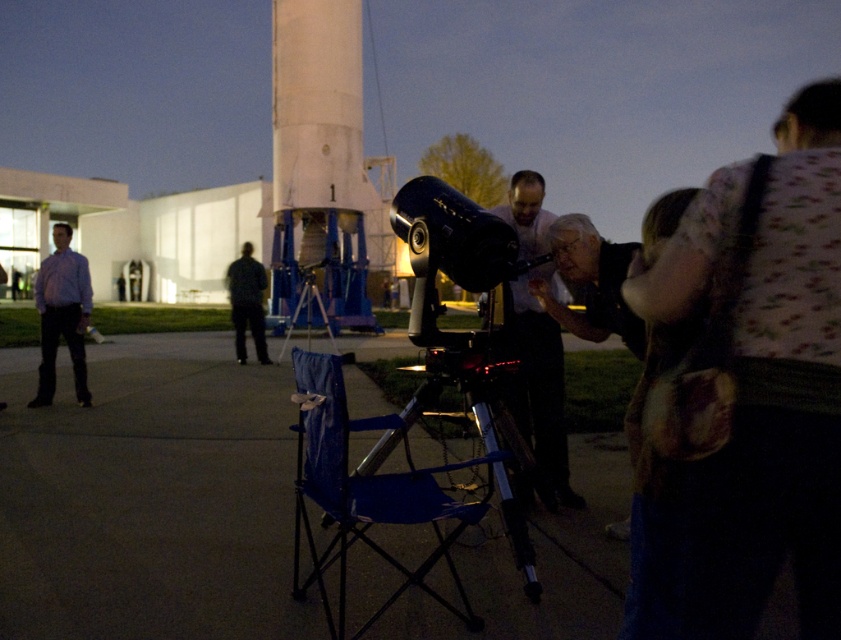
Question: Observing the image, what is the correct spatial positioning of white matte rocket at center in reference to blue fabric chair at lower center?

Choices:
 (A) above
 (B) below

Answer: (A)

Question: Can you confirm if light purple shirt at left is positioned above dark gray fabric pants at lower left?

Choices:
 (A) yes
 (B) no

Answer: (B)

Question: Which object is the farthest from the dark gray fabric pants at lower left?

Choices:
 (A) light purple shirt at left
 (B) white matte rocket at center

Answer: (B)

Question: Which point is farther from the camera taking this photo?

Choices:
 (A) (274, 264)
 (B) (242, 292)
 (C) (316, 449)
 (D) (541, 310)

Answer: (A)

Question: Which point is closer to the camera taking this photo?

Choices:
 (A) (541, 276)
 (B) (83, 385)
 (C) (237, 360)

Answer: (A)

Question: Can you confirm if matte black telescope at center is positioned below dark gray fabric pants at lower left?

Choices:
 (A) no
 (B) yes

Answer: (B)